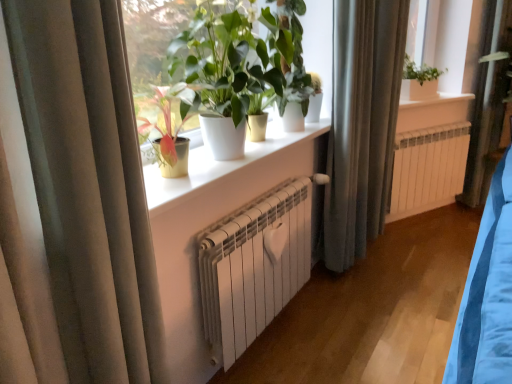
The image size is (512, 384). What are the coordinates of `free point below silky gray curtain at center, which is the second curtain from left to right (from a real-world perspective)` in the screenshot? It's located at (345, 273).